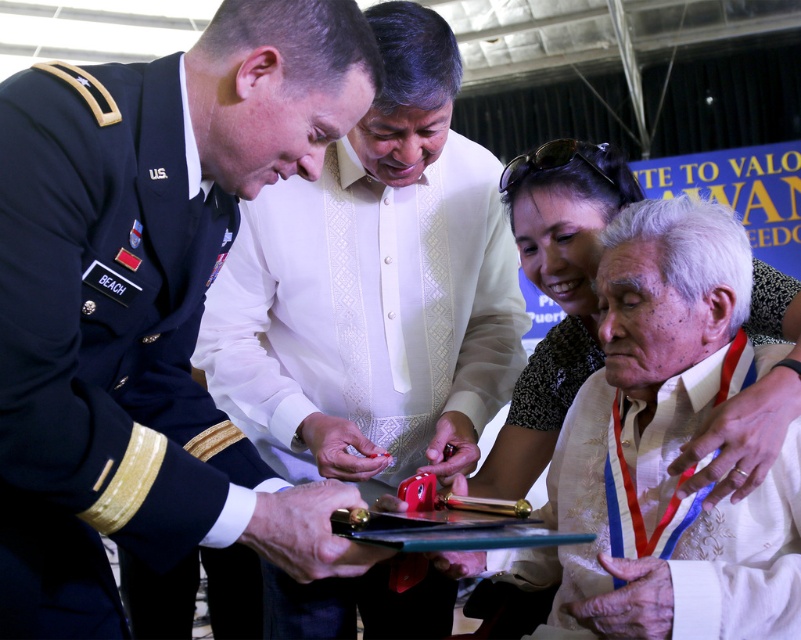
Can you confirm if navy blue fabric uniform at center is smaller than white textured shirt at center?

Yes, navy blue fabric uniform at center is smaller than white textured shirt at center.

Does navy blue fabric uniform at center appear over white textured shirt at center?

Indeed, navy blue fabric uniform at center is positioned over white textured shirt at center.

Identify the location of navy blue fabric uniform at center. (107, 349).

In the scene shown: Who is shorter, navy blue fabric uniform at center or white lace blouse at lower right?

Standing shorter between the two is white lace blouse at lower right.

Does navy blue fabric uniform at center have a lesser width compared to white lace blouse at lower right?

Indeed, navy blue fabric uniform at center has a lesser width compared to white lace blouse at lower right.

What do you see at coordinates (107, 349) in the screenshot? I see `navy blue fabric uniform at center` at bounding box center [107, 349].

Locate an element on the screen. The image size is (801, 640). navy blue fabric uniform at center is located at coordinates (107, 349).

Is point (256, 321) positioned after point (582, 374)?

No, (256, 321) is closer to viewer.

Is white textured shirt at center above white lace blouse at lower right?

Actually, white textured shirt at center is below white lace blouse at lower right.

Does point (387, 381) come farther from viewer compared to point (526, 461)?

Yes, it is behind point (526, 461).

You are a GUI agent. You are given a task and a screenshot of the screen. Output one action in this format:
    pyautogui.click(x=<x>, y=<y>)
    Task: Click on the white textured shirt at center
    Image resolution: width=801 pixels, height=640 pixels.
    Given the screenshot: What is the action you would take?
    pyautogui.click(x=373, y=288)